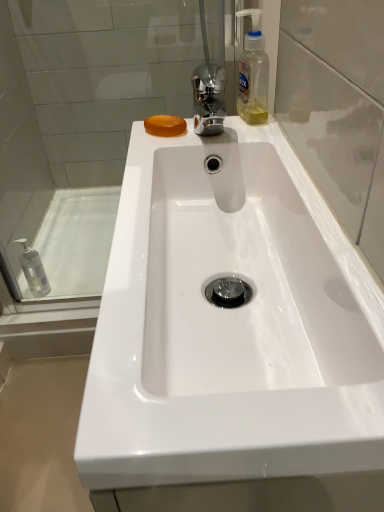
Question: Considering the relative sizes of transparent glass door at upper right and transparent glass shower door at upper left in the image provided, is transparent glass door at upper right thinner than transparent glass shower door at upper left?

Choices:
 (A) yes
 (B) no

Answer: (A)

Question: Is transparent glass door at upper right behind transparent glass shower door at upper left?

Choices:
 (A) no
 (B) yes

Answer: (A)

Question: Is transparent glass door at upper right to the right of transparent glass shower door at upper left from the viewer's perspective?

Choices:
 (A) no
 (B) yes

Answer: (B)

Question: From the image's perspective, would you say transparent glass door at upper right is shown under transparent glass shower door at upper left?

Choices:
 (A) no
 (B) yes

Answer: (B)

Question: From the image's perspective, does transparent glass door at upper right appear higher than transparent glass shower door at upper left?

Choices:
 (A) yes
 (B) no

Answer: (B)

Question: Would you say white glossy sink at center is to the left or to the right of white glossy bath at left in the picture?

Choices:
 (A) right
 (B) left

Answer: (A)

Question: Is white glossy sink at center wider or thinner than white glossy bath at left?

Choices:
 (A) thin
 (B) wide

Answer: (A)

Question: In terms of size, does white glossy sink at center appear bigger or smaller than white glossy bath at left?

Choices:
 (A) small
 (B) big

Answer: (B)

Question: Relative to white glossy bath at left, is white glossy sink at center in front or behind?

Choices:
 (A) behind
 (B) front

Answer: (B)

Question: Considering the positions of white glossy bath at left and transparent glass shower door at upper left in the image, is white glossy bath at left bigger or smaller than transparent glass shower door at upper left?

Choices:
 (A) big
 (B) small

Answer: (B)

Question: Is white glossy bath at left wider or thinner than transparent glass shower door at upper left?

Choices:
 (A) thin
 (B) wide

Answer: (B)

Question: Is white glossy bath at left to the left or to the right of transparent glass shower door at upper left in the image?

Choices:
 (A) right
 (B) left

Answer: (B)

Question: Is white glossy bath at left in front of or behind transparent glass shower door at upper left in the image?

Choices:
 (A) front
 (B) behind

Answer: (B)

Question: From a real-world perspective, is transparent glass shower door at upper left above or below clear plastic bottle at upper right?

Choices:
 (A) above
 (B) below

Answer: (B)

Question: From the image's perspective, is transparent glass shower door at upper left above or below clear plastic bottle at upper right?

Choices:
 (A) above
 (B) below

Answer: (B)